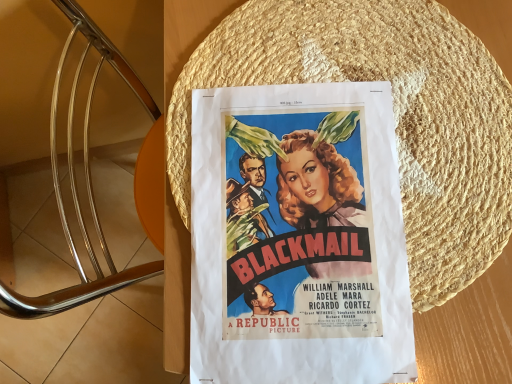
The height and width of the screenshot is (384, 512). I want to click on unoccupied space behind matte paper poster at center, so click(313, 48).